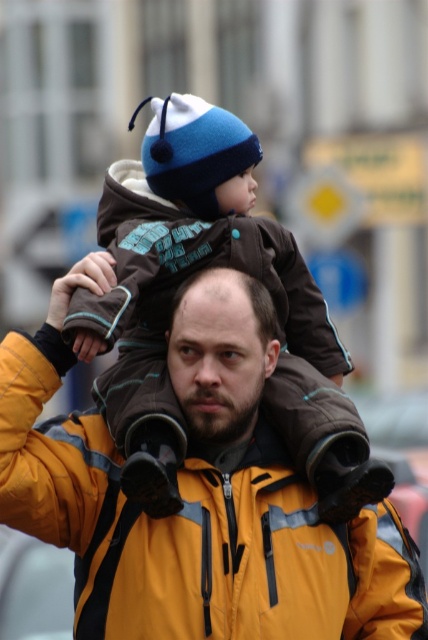
Question: Is brown fleece jacket at center wider than dark brown hair at center?

Choices:
 (A) no
 (B) yes

Answer: (B)

Question: Does brown fleece jacket at center have a larger size compared to dark brown hair at center?

Choices:
 (A) yes
 (B) no

Answer: (A)

Question: Which point appears closest to the camera in this image?

Choices:
 (A) (219, 387)
 (B) (219, 282)

Answer: (A)

Question: Which of these objects is positioned farthest from the dark brown hair at center?

Choices:
 (A) brown fleece jacket at center
 (B) yellow puffy jacket at center

Answer: (A)

Question: Which of the following is the closest to the observer?

Choices:
 (A) (86, 561)
 (B) (199, 342)

Answer: (B)

Question: Is yellow puffy jacket at center above dark brown hair at center?

Choices:
 (A) no
 (B) yes

Answer: (A)